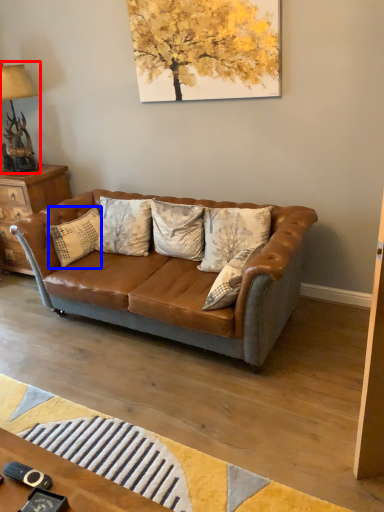
Question: Which of the following is the closest to the observer, lamp (highlighted by a red box) or pillow (highlighted by a blue box)?

Choices:
 (A) lamp
 (B) pillow

Answer: (B)